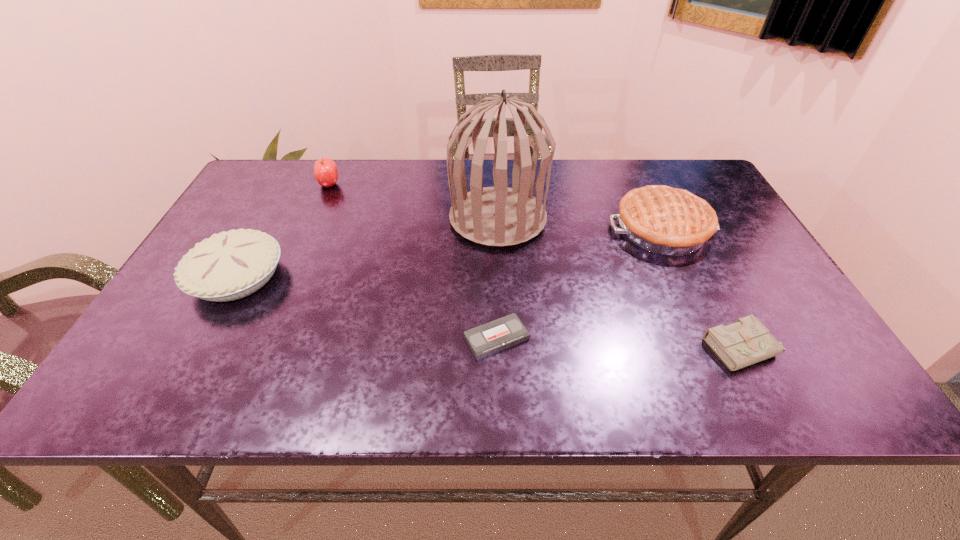
Locate an element on the screen. This screenshot has width=960, height=540. birdcage is located at coordinates (499, 216).

Where is `the right pie`? Image resolution: width=960 pixels, height=540 pixels. the right pie is located at coordinates (669, 221).

What are the coordinates of `apple` in the screenshot? It's located at (325, 170).

At what (x,y) coordinates should I click in order to perform the action: click on the left pie. Please return your answer as a coordinate pair (x, y). The height and width of the screenshot is (540, 960). Looking at the image, I should click on (231, 265).

You are a GUI agent. You are given a task and a screenshot of the screen. Output one action in this format:
    pyautogui.click(x=<x>, y=<y>)
    Task: Click on the fifth tallest object
    Image resolution: width=960 pixels, height=540 pixels.
    Given the screenshot: What is the action you would take?
    pyautogui.click(x=747, y=341)

This screenshot has height=540, width=960. Identify the location of videotape. (484, 340).

The height and width of the screenshot is (540, 960). Identify the location of vacant space located on the back of the birdcage. (495, 168).

Where is `vacant space situated 0.230m on the left of the taller pie`? The width and height of the screenshot is (960, 540). vacant space situated 0.230m on the left of the taller pie is located at coordinates (519, 229).

Identify the location of vacant space positioned 0.210m on the right of the apple. (413, 185).

At what (x,y) coordinates should I click in order to perform the action: click on blank space located on the right of the shorter pie. Please return your answer as a coordinate pair (x, y). Looking at the image, I should click on (376, 276).